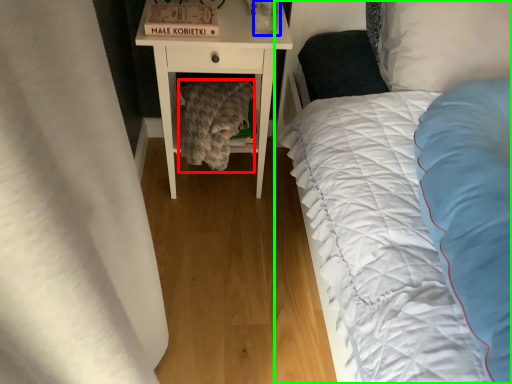
Question: Based on their relative distances, which object is farther from blanket (highlighted by a red box)? Choose from glass vase (highlighted by a blue box) and bed (highlighted by a green box).

Choices:
 (A) glass vase
 (B) bed

Answer: (B)